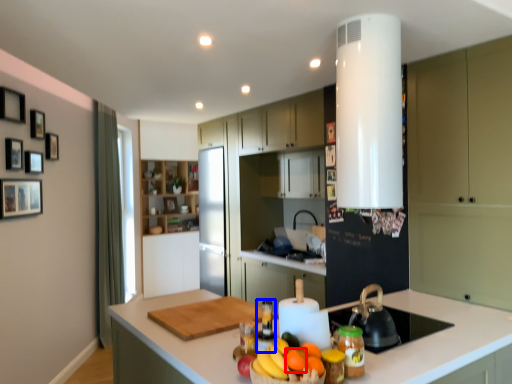
Question: Which object is closer to the camera taking this photo, orange (highlighted by a red box) or bottle (highlighted by a blue box)?

Choices:
 (A) orange
 (B) bottle

Answer: (A)